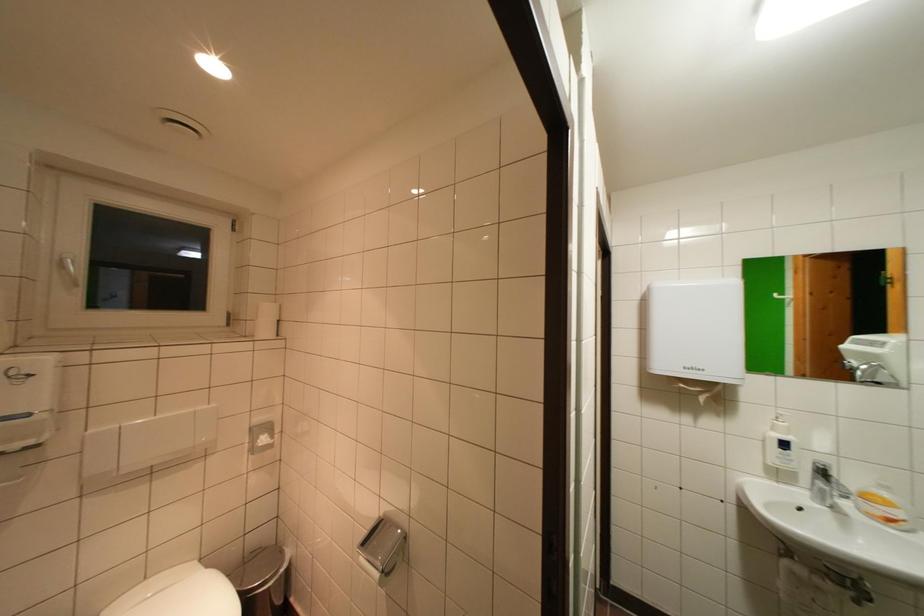
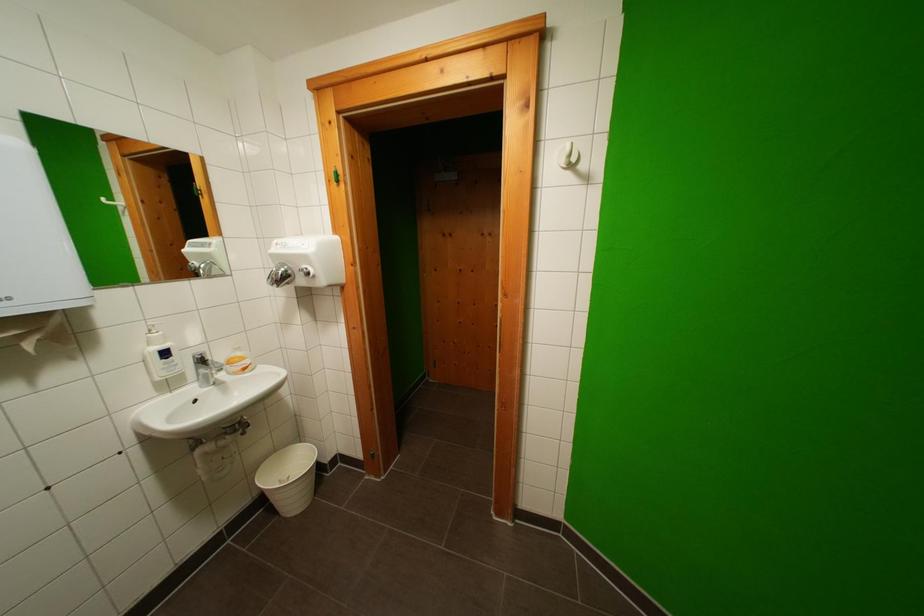
Find the pixel in the second image that matches point (893, 498) in the first image.

(246, 357)